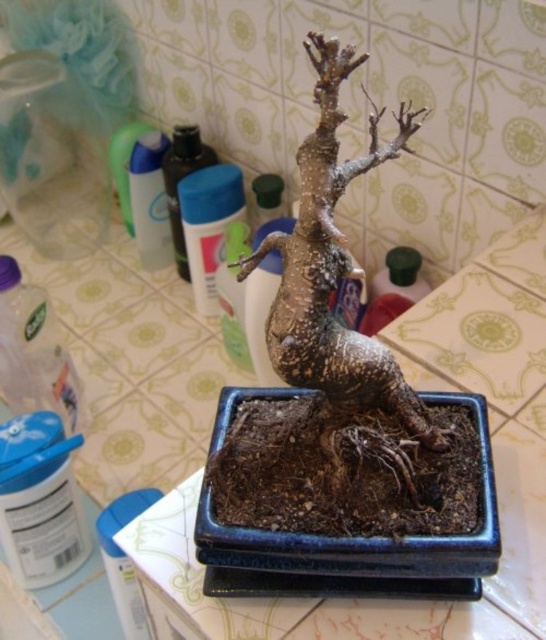
Question: Among these objects, which one is nearest to the camera?

Choices:
 (A) clear plastic bottle at lower left
 (B) green plastic bottle at center-right
 (C) translucent plastic bottle at upper left

Answer: (A)

Question: Which point is closer to the camera?

Choices:
 (A) translucent plastic bottle at upper left
 (B) clear plastic bottle at lower left
 (C) green plastic bottle at center-right

Answer: (B)

Question: Is green plastic bottle at center-right to the right of translucent plastic bottle at upper left from the viewer's perspective?

Choices:
 (A) yes
 (B) no

Answer: (A)

Question: Can you confirm if clear plastic bottle at lower left is positioned to the right of translucent plastic bottle at upper left?

Choices:
 (A) no
 (B) yes

Answer: (A)

Question: Which object is the closest to the translucent plastic bottle at upper left?

Choices:
 (A) clear plastic bottle at lower left
 (B) green plastic bottle at center-right

Answer: (A)

Question: Does clear plastic bottle at lower left appear under translucent plastic bottle at upper left?

Choices:
 (A) no
 (B) yes

Answer: (B)